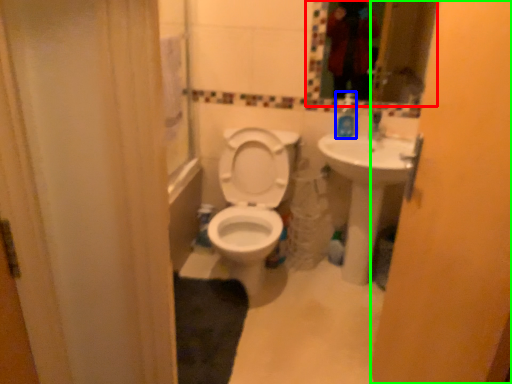
Question: Which object is positioned closest to mirror (highlighted by a red box)? Select from soap dispenser (highlighted by a blue box) and screen door (highlighted by a green box).

Choices:
 (A) soap dispenser
 (B) screen door

Answer: (A)